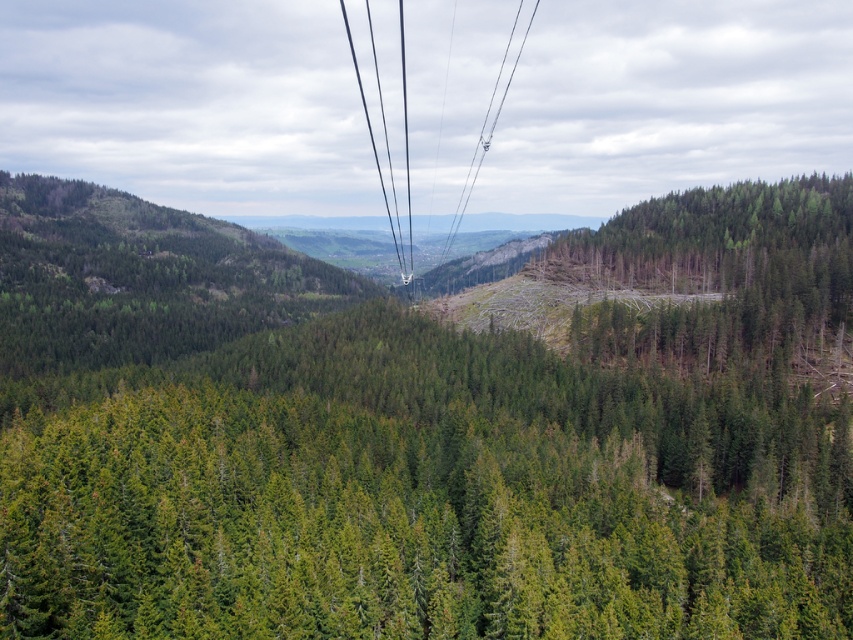
Question: Where is green matte forest at center located in relation to metallic wire at center in the image?

Choices:
 (A) above
 (B) below

Answer: (B)

Question: Among these objects, which one is farthest from the camera?

Choices:
 (A) metallic wire at center
 (B) green matte forest at center

Answer: (A)

Question: Which object appears closest to the camera in this image?

Choices:
 (A) metallic wire at center
 (B) green matte forest at center

Answer: (B)

Question: Which point is closer to the camera?

Choices:
 (A) green matte forest at center
 (B) metallic wire at center

Answer: (A)

Question: Is green matte forest at center smaller than metallic wire at center?

Choices:
 (A) yes
 (B) no

Answer: (B)

Question: Can you confirm if green matte forest at center is wider than metallic wire at center?

Choices:
 (A) yes
 (B) no

Answer: (A)